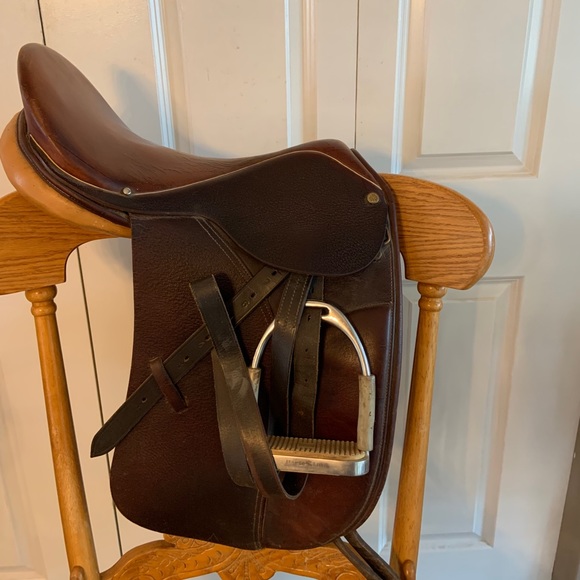
Identify the location of slats. The width and height of the screenshot is (580, 580). (177, 368), (270, 273), (253, 298), (208, 338), (145, 401).